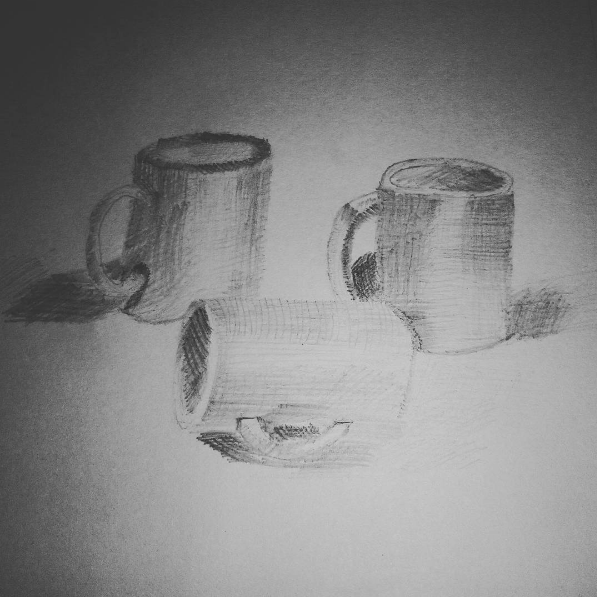
Find the location of a particular element. This screenshot has height=597, width=597. cup i would drink from is located at coordinates (193, 236).